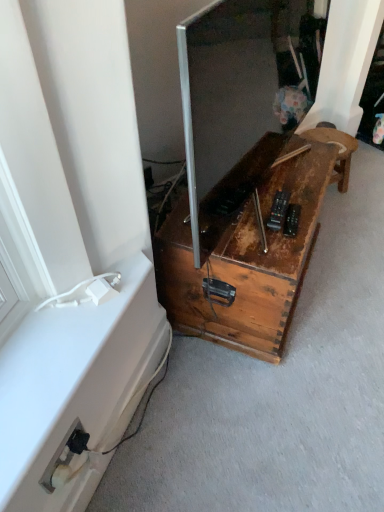
Find the location of a particular element. This screenshot has width=384, height=512. vacant space underneath metallic silver screen at center (from a real-world perspective) is located at coordinates (264, 192).